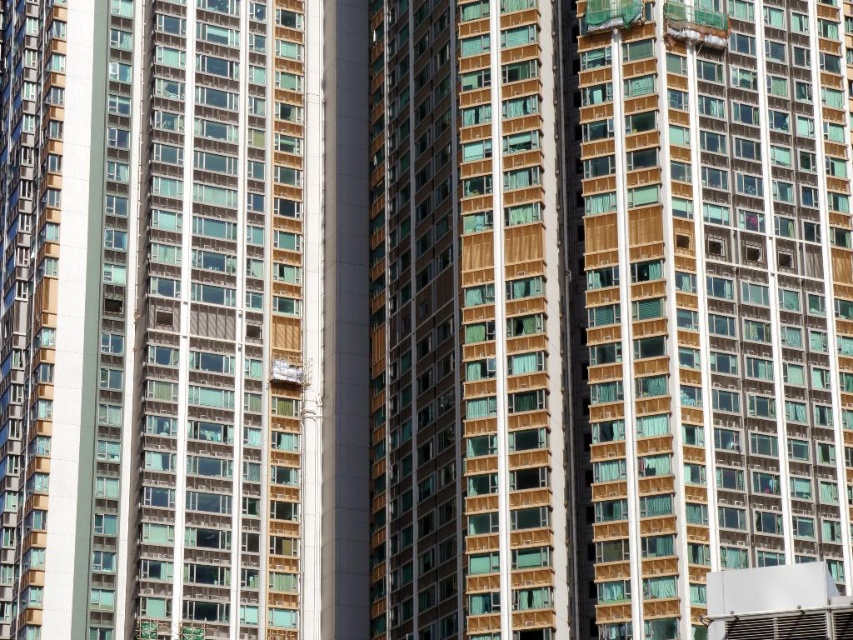
From the picture: Is the position of matte gold building at center less distant than that of matte brown building at center?

Yes, matte gold building at center is in front of matte brown building at center.

Which is in front, point (462, 346) or point (300, 92)?

Point (462, 346)

Between point (395, 420) and point (364, 218), which one is positioned in front?

Point (395, 420) is more forward.

Find the location of `matte gold building at center`. matte gold building at center is located at coordinates (604, 308).